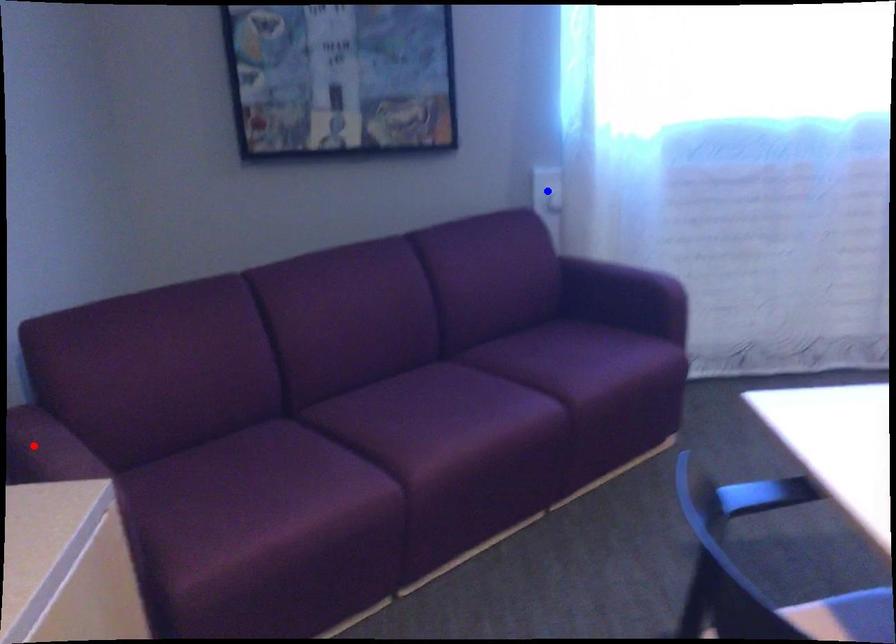
Question: Which of the two points in the image is closer to the camera?

Choices:
 (A) Blue point is closer.
 (B) Red point is closer.

Answer: (B)